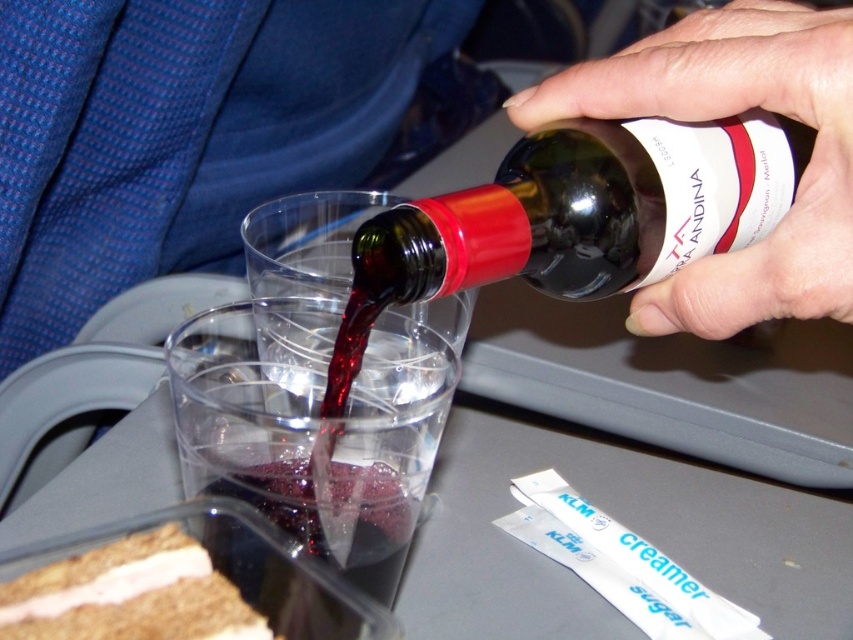
Question: Is smooth skin hand at upper right positioned before brown crumbly cake at lower left?

Choices:
 (A) yes
 (B) no

Answer: (B)

Question: Among these objects, which one is farthest from the camera?

Choices:
 (A) smooth skin hand at upper right
 (B) dark glass bottle at upper center
 (C) brown crumbly cake at lower left

Answer: (A)

Question: Which point appears farthest from the camera in this image?

Choices:
 (A) (819, 253)
 (B) (651, 236)

Answer: (B)

Question: Which of the following is the farthest from the observer?

Choices:
 (A) brown crumbly cake at lower left
 (B) dark glass bottle at upper center

Answer: (B)

Question: In this image, where is smooth skin hand at upper right located relative to brown crumbly cake at lower left?

Choices:
 (A) right
 (B) left

Answer: (A)

Question: Does smooth skin hand at upper right have a greater width compared to brown crumbly cake at lower left?

Choices:
 (A) no
 (B) yes

Answer: (B)